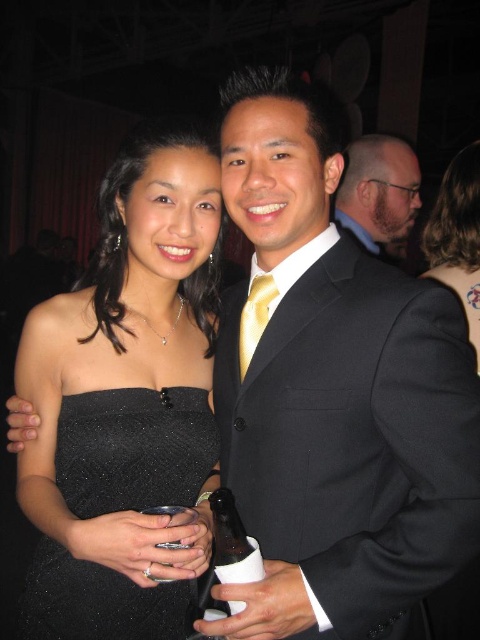
Question: Is black satin dress at center positioned at the back of black sparkly dress at center?

Choices:
 (A) yes
 (B) no

Answer: (B)

Question: Estimate the real-world distances between objects in this image. Which object is farther from the black sparkly dress at center?

Choices:
 (A) dark gray suit at center
 (B) black satin dress at upper right

Answer: (A)

Question: Which object is positioned farthest from the black glass bottle at center?

Choices:
 (A) gold silk tie at center
 (B) black satin dress at upper right
 (C) black sparkly dress at center
 (D) black satin dress at center

Answer: (B)

Question: From the image, what is the correct spatial relationship of black wool suit at center in relation to black glass bottle at center?

Choices:
 (A) left
 (B) right

Answer: (B)

Question: Which is farther from the black satin dress at center?

Choices:
 (A) black wool suit at center
 (B) black satin dress at upper right
 (C) gold silk tie at center

Answer: (B)

Question: Does black satin dress at center appear on the right side of black sparkly dress at center?

Choices:
 (A) yes
 (B) no

Answer: (A)